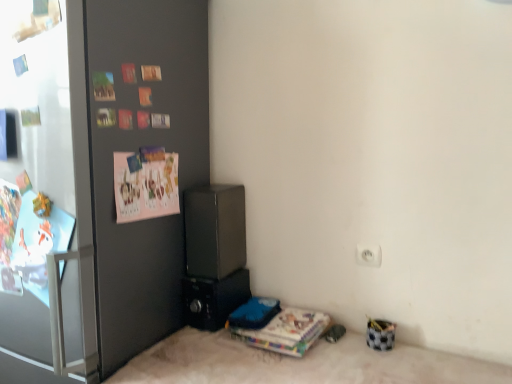
You are a GUI agent. You are given a task and a screenshot of the screen. Output one action in this format:
    pyautogui.click(x=<x>, y=<y>)
    Task: Click on the vacant space to the right of multicolored paper stack at lower center
    
    Given the screenshot: What is the action you would take?
    pyautogui.click(x=361, y=353)